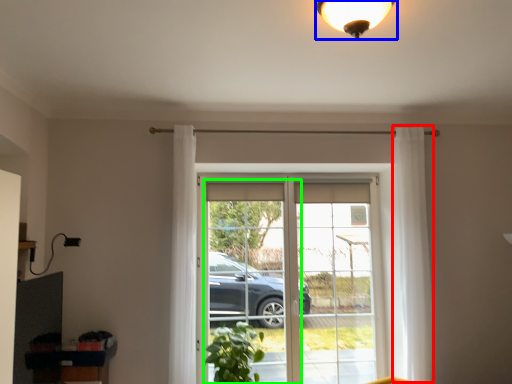
Question: Estimate the real-world distances between objects in this image. Which object is farther from curtain (highlighted by a red box), lamp (highlighted by a blue box) or screen door (highlighted by a green box)?

Choices:
 (A) lamp
 (B) screen door

Answer: (B)